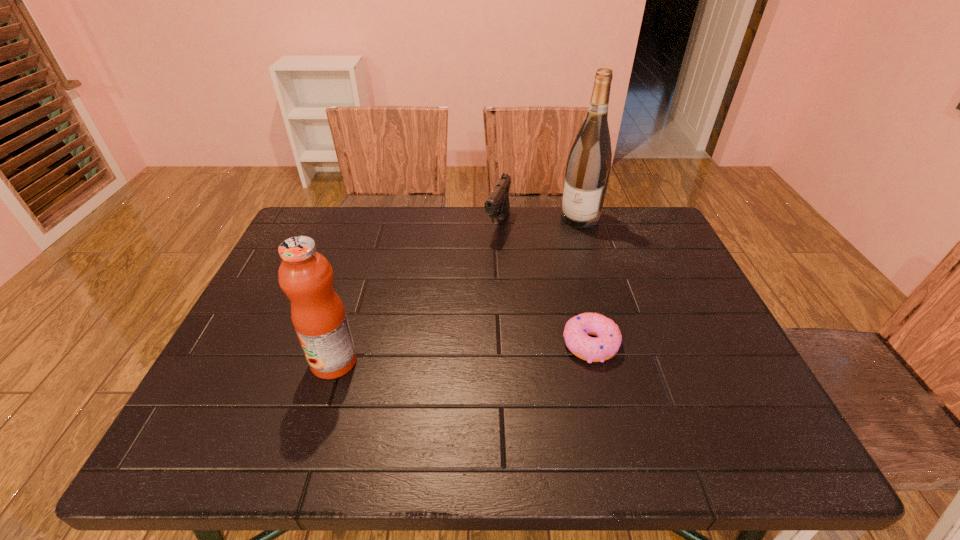
Identify the location of unoccupied position between the pistol and the doughnut. (544, 284).

The width and height of the screenshot is (960, 540). Find the location of `vacant area between the third object from right to left and the doughnut`. vacant area between the third object from right to left and the doughnut is located at coordinates (544, 284).

Find the location of a particular element. vacant area that lies between the pistol and the tallest object is located at coordinates (539, 221).

Find the location of `vacant space that's between the shortest object and the leftmost object`. vacant space that's between the shortest object and the leftmost object is located at coordinates (462, 353).

Identify the location of free spot between the pistol and the fruit juice. Image resolution: width=960 pixels, height=540 pixels. (416, 293).

Identify the location of object that stands as the third closest to the tallest object. The image size is (960, 540). (318, 315).

Select which object is the closest to the wine bottle. Please provide its 2D coordinates. Your answer should be formatted as a tuple, i.e. [(x, y)], where the tuple contains the x and y coordinates of a point satisfying the conditions above.

[(497, 205)]